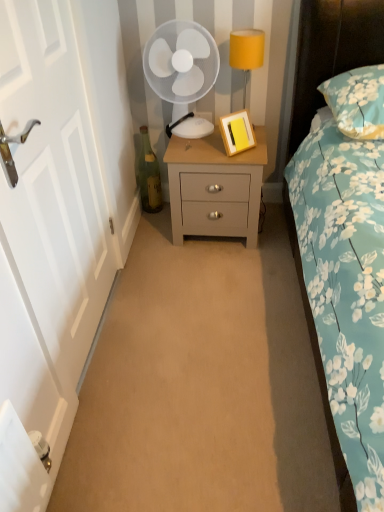
Where is `vacant area in front of green glass bottle at lower left`? vacant area in front of green glass bottle at lower left is located at coordinates 150,226.